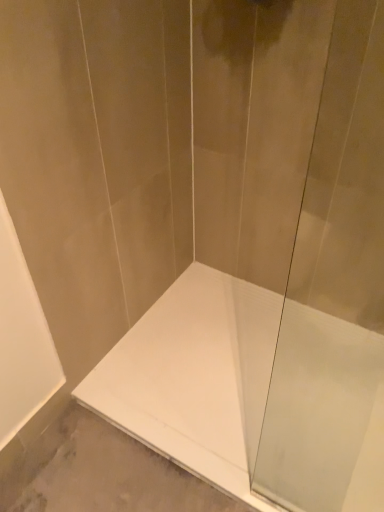
Where is `free spot above white glossy bathtub at center (from a real-world perspective)`? The width and height of the screenshot is (384, 512). free spot above white glossy bathtub at center (from a real-world perspective) is located at coordinates (201, 354).